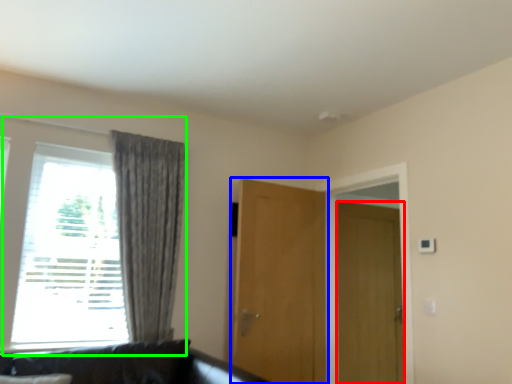
Question: Which is nearer to the door (highlighted by a red box)? door (highlighted by a blue box) or window (highlighted by a green box).

Choices:
 (A) door
 (B) window

Answer: (A)